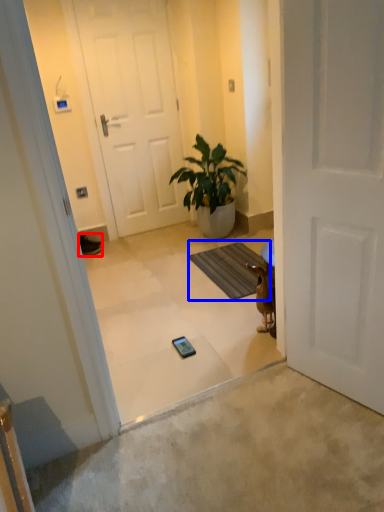
Question: Which of the following is the farthest to the observer, sneakers (highlighted by a red box) or bath mat (highlighted by a blue box)?

Choices:
 (A) sneakers
 (B) bath mat

Answer: (A)